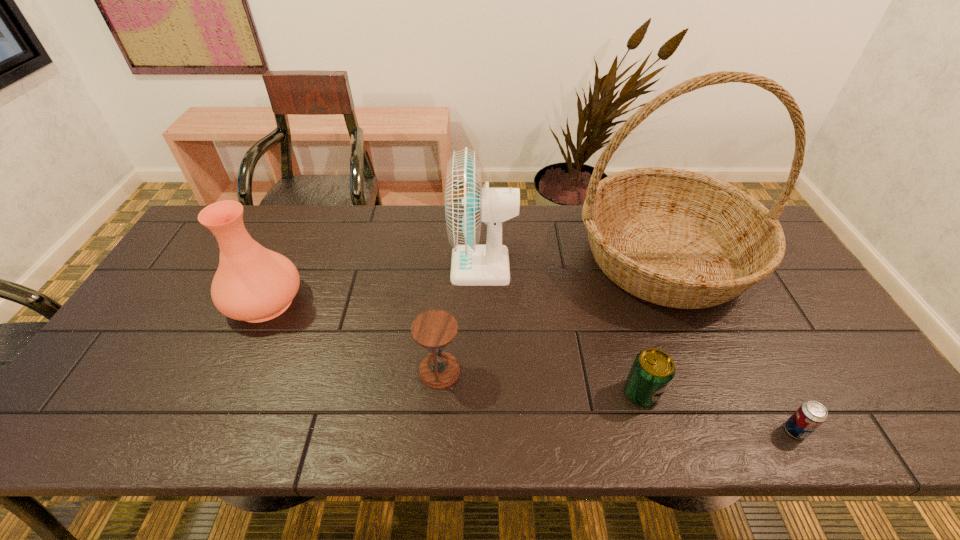
Where is `vacant space located in front of the fan to face the airflow`? vacant space located in front of the fan to face the airflow is located at coordinates (384, 267).

Locate an element on the screen. This screenshot has height=540, width=960. vacant space located in front of the fan to face the airflow is located at coordinates (371, 267).

Find the location of a particular element. This screenshot has width=960, height=540. free space located in front of the fan to face the airflow is located at coordinates (345, 267).

I want to click on vacant space located on the front of the leftmost object, so click(x=220, y=398).

Where is `vacant position located on the back of the third shortest object`? The image size is (960, 540). vacant position located on the back of the third shortest object is located at coordinates (446, 273).

You are a GUI agent. You are given a task and a screenshot of the screen. Output one action in this format:
    pyautogui.click(x=<x>, y=<y>)
    Task: Click on the free region located 0.340m on the left of the second shortest object
    
    Given the screenshot: What is the action you would take?
    pyautogui.click(x=478, y=394)

You are a GUI agent. You are given a task and a screenshot of the screen. Output one action in this format:
    pyautogui.click(x=<x>, y=<y>)
    Task: Click on the free space located on the left of the shortest object
    This screenshot has width=960, height=540.
    Given the screenshot: What is the action you would take?
    pyautogui.click(x=707, y=430)

The height and width of the screenshot is (540, 960). In order to click on basket that is at the far edge in this screenshot , I will do `click(676, 238)`.

At what (x,y) coordinates should I click in order to perform the action: click on fan present at the far edge. Please return your answer as a coordinate pair (x, y). The height and width of the screenshot is (540, 960). Looking at the image, I should click on (467, 204).

This screenshot has width=960, height=540. What are the coordinates of `object that is at the right edge` in the screenshot? It's located at [x=676, y=238].